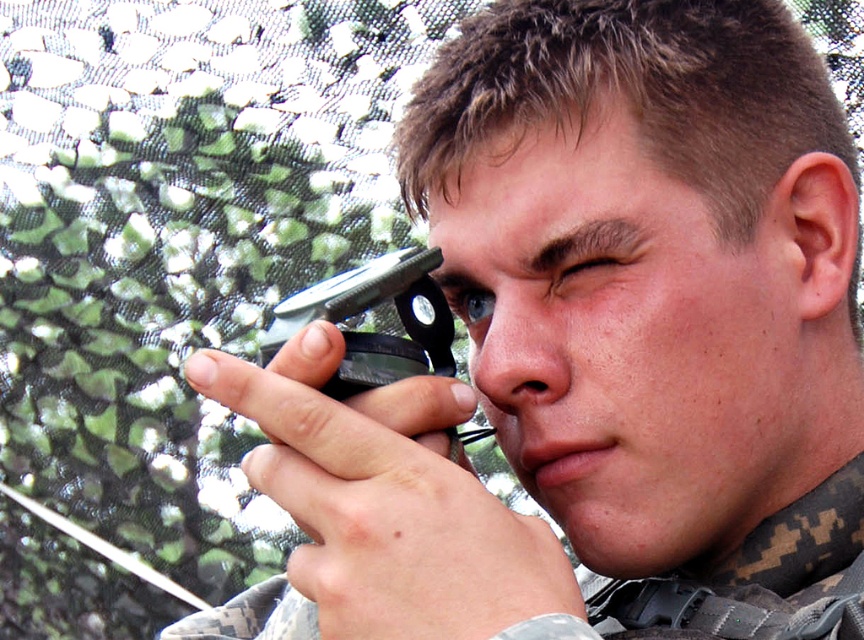
Does camouflage fabric at center have a lesser width compared to pinkish skin ear at right?

No.

Is camouflage fabric at center taller than pinkish skin ear at right?

Indeed, camouflage fabric at center has a greater height compared to pinkish skin ear at right.

Describe the element at coordinates (744, 582) in the screenshot. The width and height of the screenshot is (864, 640). I see `camouflage fabric at center` at that location.

In order to click on camouflage fabric at center in this screenshot , I will do `click(744, 582)`.